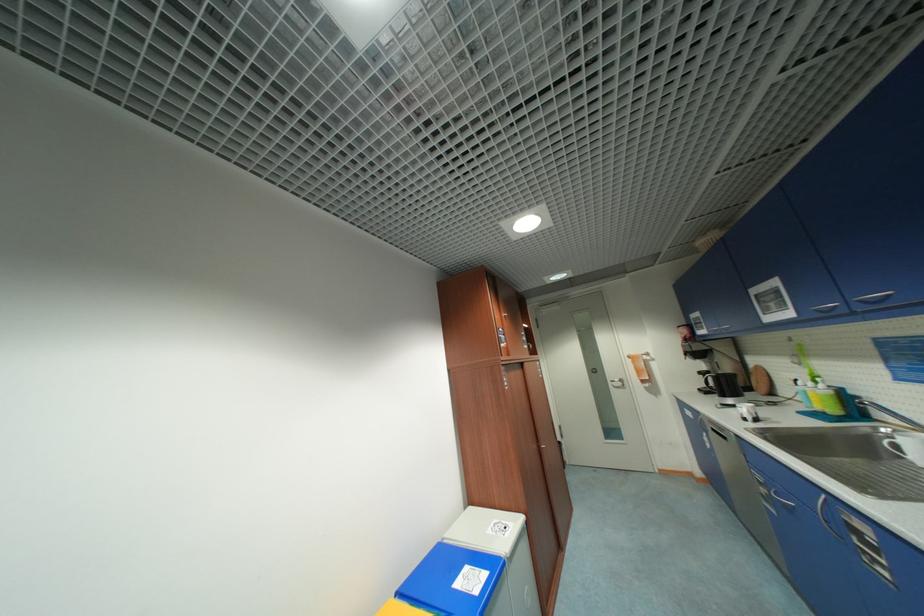
Image resolution: width=924 pixels, height=616 pixels. What do you see at coordinates (707, 382) in the screenshot? I see `the black coffee mug` at bounding box center [707, 382].